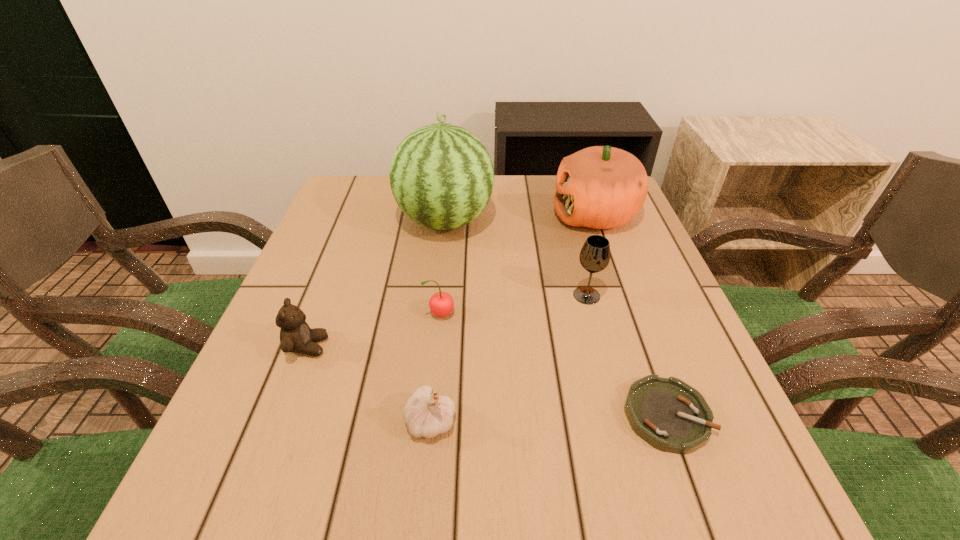
Locate an element on the screen. Image resolution: width=960 pixels, height=540 pixels. free space located on the face of the sixth shortest object is located at coordinates (459, 214).

This screenshot has height=540, width=960. I want to click on vacant area situated 0.270m on the face of the sixth shortest object, so click(447, 214).

What are the coordinates of `free point located on the face of the sixth shortest object` in the screenshot? It's located at (467, 214).

Where is `blank space located on the front of the wineglass`? The height and width of the screenshot is (540, 960). blank space located on the front of the wineglass is located at coordinates (607, 369).

Locate an element on the screen. The image size is (960, 540). free space located 0.220m on the face of the teddy bear is located at coordinates (447, 347).

Locate an element on the screen. vacant space positioned on the front of the fourth farthest object is located at coordinates (432, 404).

The width and height of the screenshot is (960, 540). What are the coordinates of `vacant area located 0.050m on the right of the garlic` in the screenshot? It's located at (488, 421).

Where is `free space located on the left of the ashtray`? This screenshot has height=540, width=960. free space located on the left of the ashtray is located at coordinates (418, 415).

Locate an element on the screen. watermelon that is positioned at the far edge is located at coordinates (441, 175).

You are a GUI agent. You are given a task and a screenshot of the screen. Output one action in this format:
    pyautogui.click(x=<x>, y=<y>)
    Task: Click on the pumpkin positioned at the far edge
    This screenshot has width=960, height=540.
    Given the screenshot: What is the action you would take?
    pyautogui.click(x=601, y=187)